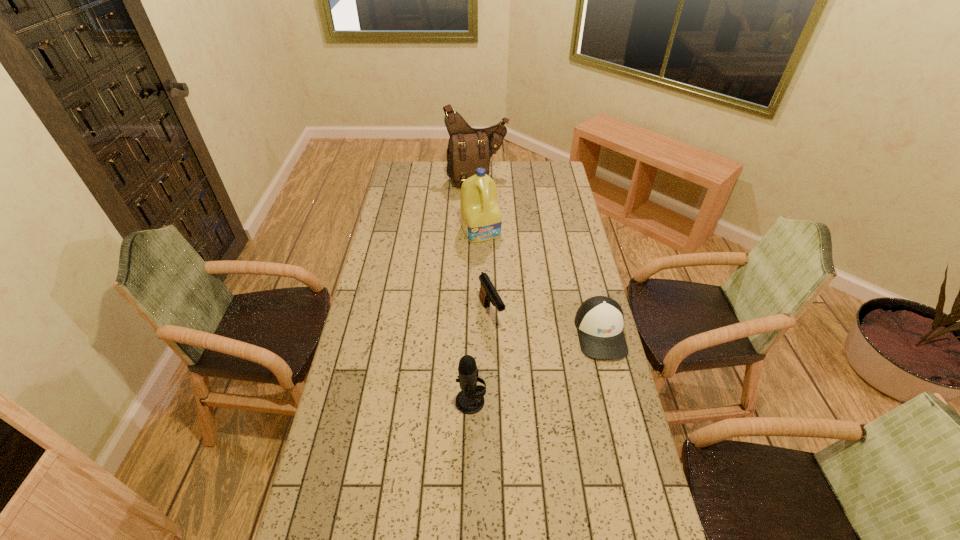
Identify the location of free region located 0.160m on the front panel of the rightmost object. (618, 404).

The width and height of the screenshot is (960, 540). Identify the location of free space located 0.290m on the label of the detergent. (512, 286).

I want to click on free space located 0.080m on the label of the detergent, so click(493, 254).

The width and height of the screenshot is (960, 540). Find the location of `free space located on the label of the detergent`. free space located on the label of the detergent is located at coordinates (503, 271).

Locate an element on the screen. free space located 0.360m at the barrel of the second shortest object is located at coordinates (541, 415).

Locate an element on the screen. The image size is (960, 540). free space located 0.250m at the barrel of the second shortest object is located at coordinates (526, 387).

Locate an element on the screen. vacant space located at the barrel of the second shortest object is located at coordinates pyautogui.click(x=514, y=363).

Where is `vacant region located 0.270m on the front-facing side of the tallest object`? vacant region located 0.270m on the front-facing side of the tallest object is located at coordinates (499, 224).

Where is `free space located 0.070m on the front-facing side of the tallest object`? free space located 0.070m on the front-facing side of the tallest object is located at coordinates (489, 200).

Where is `free location located 0.340m on the front-facing side of the tallest object`? free location located 0.340m on the front-facing side of the tallest object is located at coordinates (504, 232).